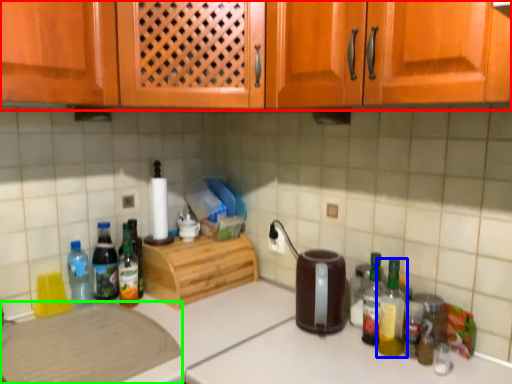
Question: Which is farther away from cabinetry (highlighted by a red box)? bottle (highlighted by a blue box) or cutting board (highlighted by a green box)?

Choices:
 (A) bottle
 (B) cutting board

Answer: (A)